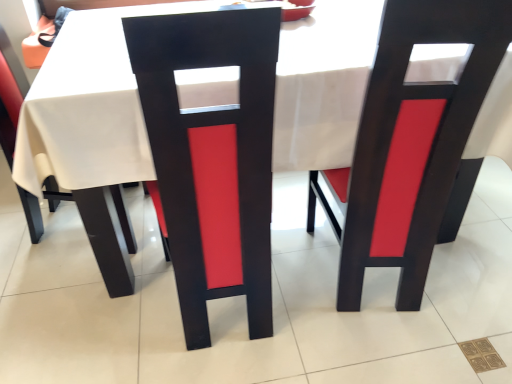
This screenshot has width=512, height=384. In order to click on free spot to the right of matte black chair at center, which is the 1th chair in right-to-left order in this screenshot , I will do `click(469, 277)`.